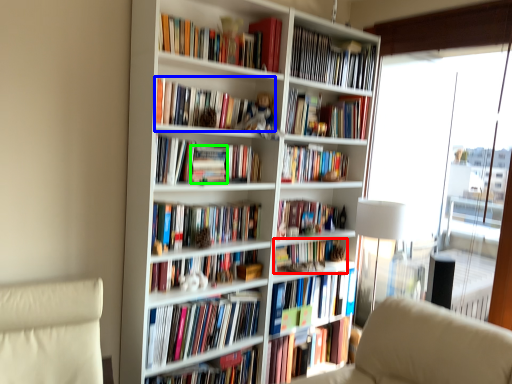
Question: Which object is positioned closest to book (highlighted by a red box)? Select from book (highlighted by a blue box) and paperback book (highlighted by a green box).

Choices:
 (A) book
 (B) paperback book

Answer: (B)